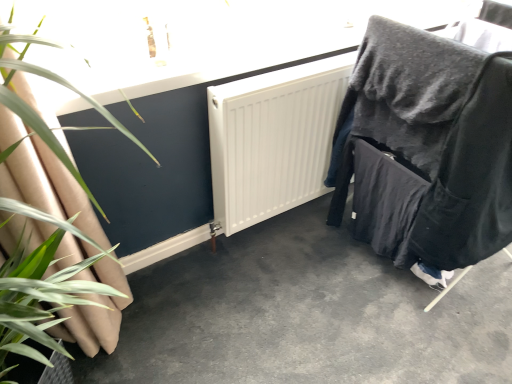
Question: Considering the relative sizes of smooth concrete floor at center and velvet black chair at right in the image provided, is smooth concrete floor at center shorter than velvet black chair at right?

Choices:
 (A) yes
 (B) no

Answer: (A)

Question: Can you confirm if smooth concrete floor at center is positioned to the right of velvet black chair at right?

Choices:
 (A) yes
 (B) no

Answer: (B)

Question: Is smooth concrete floor at center further to camera compared to velvet black chair at right?

Choices:
 (A) no
 (B) yes

Answer: (A)

Question: From the image's perspective, is smooth concrete floor at center under velvet black chair at right?

Choices:
 (A) yes
 (B) no

Answer: (A)

Question: Is the depth of smooth concrete floor at center less than that of velvet black chair at right?

Choices:
 (A) yes
 (B) no

Answer: (A)

Question: Is smooth concrete floor at center outside velvet black chair at right?

Choices:
 (A) yes
 (B) no

Answer: (A)

Question: Does velvet black chair at right have a smaller size compared to green leafy plant at left?

Choices:
 (A) yes
 (B) no

Answer: (B)

Question: Considering the relative positions of velvet black chair at right and green leafy plant at left in the image provided, is velvet black chair at right to the right of green leafy plant at left from the viewer's perspective?

Choices:
 (A) yes
 (B) no

Answer: (A)

Question: From the image's perspective, is velvet black chair at right on top of green leafy plant at left?

Choices:
 (A) yes
 (B) no

Answer: (A)

Question: Does velvet black chair at right contain green leafy plant at left?

Choices:
 (A) no
 (B) yes

Answer: (A)

Question: Would you say velvet black chair at right is outside green leafy plant at left?

Choices:
 (A) yes
 (B) no

Answer: (A)

Question: Does velvet black chair at right have a lesser width compared to green leafy plant at left?

Choices:
 (A) no
 (B) yes

Answer: (A)

Question: Is green leafy plant at left to the left of velvet black chair at right from the viewer's perspective?

Choices:
 (A) yes
 (B) no

Answer: (A)